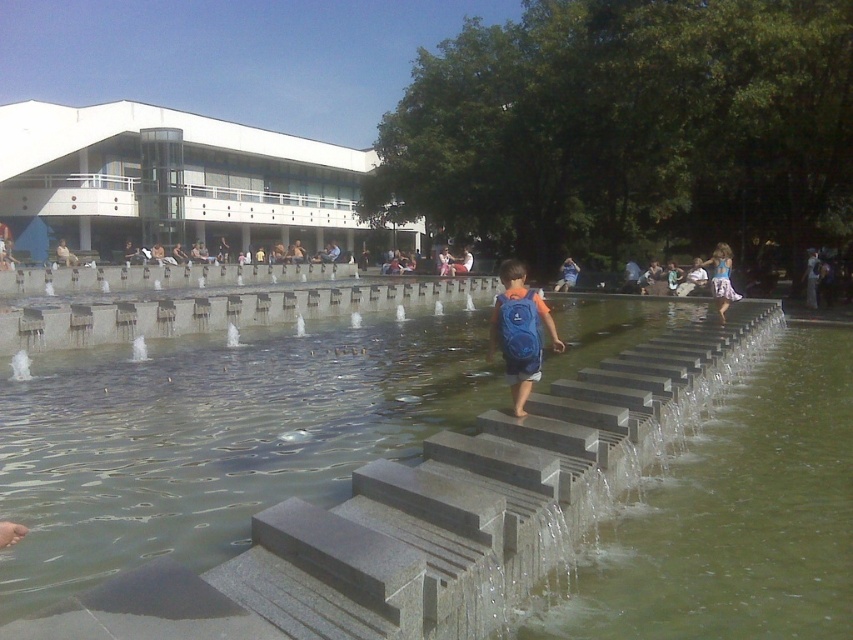
Question: Is blue fabric backpack at center to the left of blue denim dress at right from the viewer's perspective?

Choices:
 (A) no
 (B) yes

Answer: (B)

Question: Is blue fabric backpack at center to the right of dark blue backpack at center from the viewer's perspective?

Choices:
 (A) yes
 (B) no

Answer: (B)

Question: Among these points, which one is nearest to the camera?

Choices:
 (A) (639, 577)
 (B) (564, 273)
 (C) (814, 257)
 (D) (711, 275)

Answer: (A)

Question: Which point appears closest to the camera in this image?

Choices:
 (A) (561, 275)
 (B) (722, 269)
 (C) (502, 336)
 (D) (808, 296)

Answer: (C)

Question: In this image, where is blue denim dress at right located relative to light brown wooden bench at center?

Choices:
 (A) right
 (B) left

Answer: (A)

Question: Which of the following is the closest to the observer?

Choices:
 (A) (724, 273)
 (B) (810, 259)

Answer: (A)